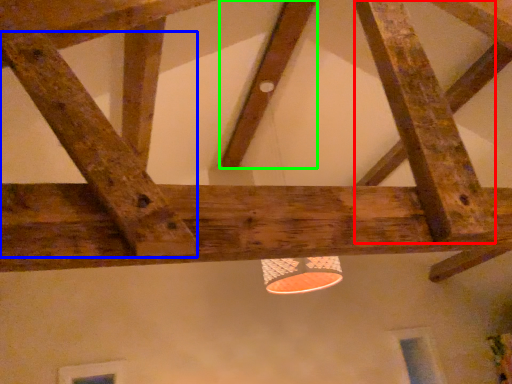
Question: Estimate the real-world distances between objects in this image. Which object is farther from plank (highlighted by a red box), plank (highlighted by a blue box) or plank (highlighted by a green box)?

Choices:
 (A) plank
 (B) plank

Answer: (B)